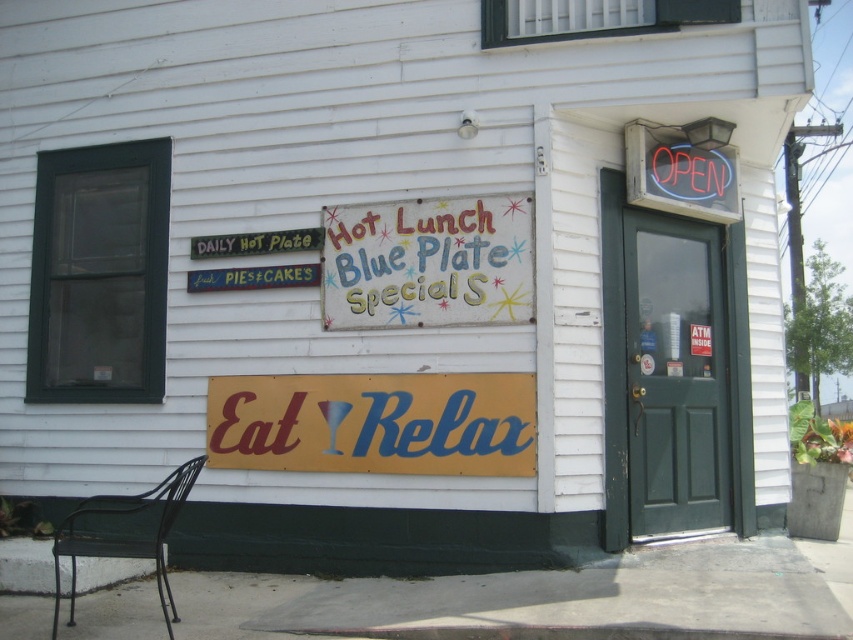
You are standing in front of the diner and notice two points on the building facade. Which point, point 1 at coordinates (436, 228) or point 2 at coordinates (115, 509), is closer to you?

Point 1 at coordinates (436, 228) is closer to you because it is further to the viewer than point 2 at coordinates (115, 509).

You are a customer standing outside the diner and want to read both the yellow matte sign at center and the painted wood signboard at center. Which sign will you need to look up closer to read?

The yellow matte sign at center is larger in size than the painted wood signboard at center, so you can read it from a closer distance without needing to get too near. However, the painted wood signboard at center is smaller, so you might need to move closer to read it properly.